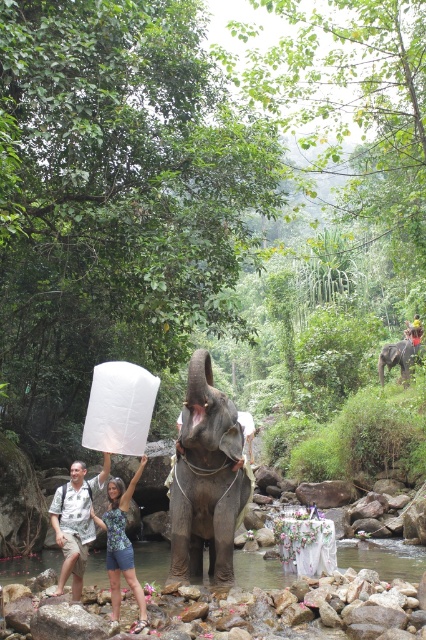
Is clear water at river center above blue printed tank top at center?

Incorrect, clear water at river center is not positioned above blue printed tank top at center.

At what (x,y) coordinates should I click in order to perform the action: click on clear water at river center. Please return your answer as a coordinate pair (x, y). Looking at the image, I should click on (385, 557).

Locate an element on the screen. clear water at river center is located at coordinates (385, 557).

Between clear water at river center and gray matte elephant at center, which one appears on the left side from the viewer's perspective?

clear water at river center is more to the left.

Between point (393, 577) and point (396, 356), which one is positioned behind?

Positioned behind is point (396, 356).

The height and width of the screenshot is (640, 426). In order to click on clear water at river center in this screenshot , I will do click(x=385, y=557).

Is clear water at river center in front of printed cotton shirt at center?

No, clear water at river center is further to the viewer.

Is point (22, 577) closer to viewer compared to point (106, 456)?

No, (22, 577) is further to viewer.

The height and width of the screenshot is (640, 426). What do you see at coordinates (385, 557) in the screenshot?
I see `clear water at river center` at bounding box center [385, 557].

Where is `clear water at river center`? This screenshot has height=640, width=426. clear water at river center is located at coordinates (385, 557).